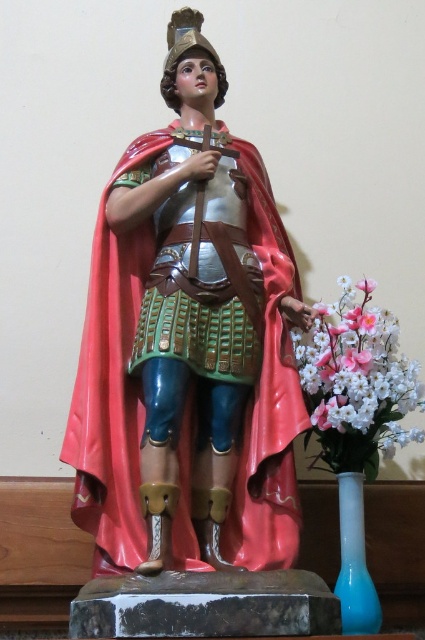
Question: Among these objects, which one is nearest to the camera?

Choices:
 (A) shiny plastic statue at center
 (B) white silk flowers at right

Answer: (A)

Question: Can you confirm if shiny plastic statue at center is thinner than white silk flowers at right?

Choices:
 (A) yes
 (B) no

Answer: (B)

Question: Is white silk flowers at right to the left of blue glass vase at lower right from the viewer's perspective?

Choices:
 (A) no
 (B) yes

Answer: (A)

Question: Which object is positioned farthest from the white silk flowers at right?

Choices:
 (A) blue glass vase at lower right
 (B) shiny plastic statue at center

Answer: (B)

Question: Estimate the real-world distances between objects in this image. Which object is closer to the shiny plastic statue at center?

Choices:
 (A) blue glass vase at lower right
 (B) white silk flowers at right

Answer: (B)

Question: Is the position of shiny plastic statue at center less distant than that of blue glass vase at lower right?

Choices:
 (A) yes
 (B) no

Answer: (A)